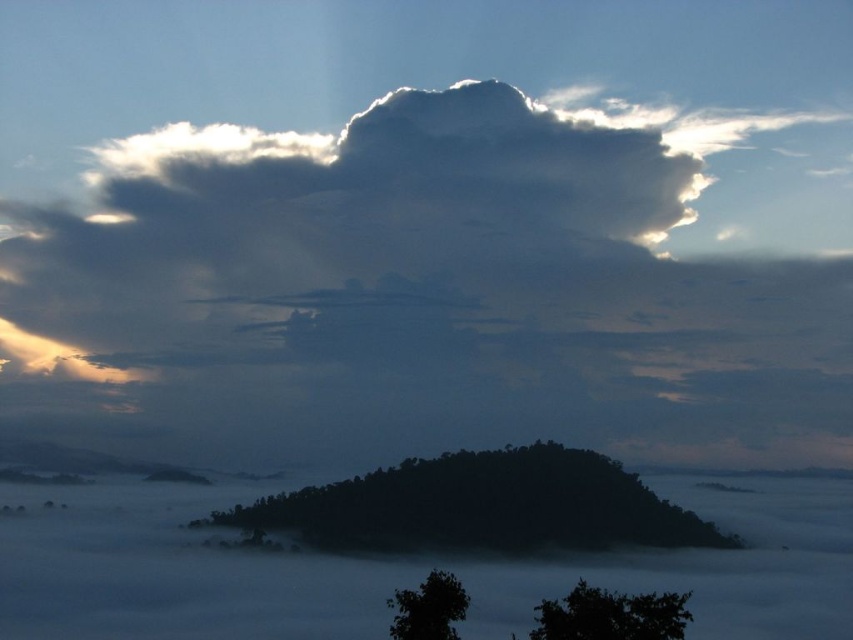
Does black matte tree at center appear over dark green leafy tree at lower center?

Correct, black matte tree at center is located above dark green leafy tree at lower center.

The height and width of the screenshot is (640, 853). In order to click on black matte tree at center in this screenshot , I will do `click(480, 506)`.

Can you confirm if black matte tree at center is shorter than dark green leafy tree at lower right?

In fact, black matte tree at center may be taller than dark green leafy tree at lower right.

Who is more distant from viewer, (450, 516) or (624, 636)?

Positioned behind is point (450, 516).

I want to click on black matte tree at center, so click(x=480, y=506).

Is dark green leafy tree at lower right taller than dark green leafy tree at lower center?

In fact, dark green leafy tree at lower right may be shorter than dark green leafy tree at lower center.

The height and width of the screenshot is (640, 853). What do you see at coordinates (611, 616) in the screenshot?
I see `dark green leafy tree at lower right` at bounding box center [611, 616].

Locate an element on the screen. The height and width of the screenshot is (640, 853). dark green leafy tree at lower right is located at coordinates (611, 616).